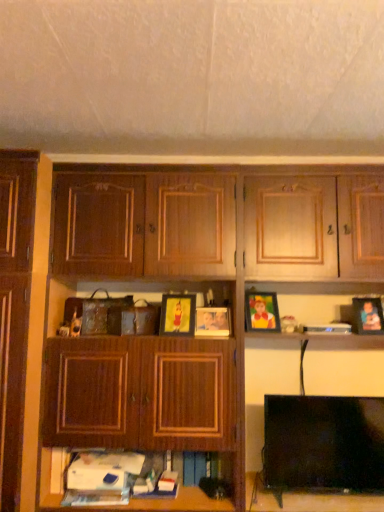
You are a GUI agent. You are given a task and a screenshot of the screen. Output one action in this format:
    pyautogui.click(x=<x>, y=<y>)
    Task: Click on the matte plastic picture frame at center, marked as the third picture frame in a left-to-right arrangement
    This screenshot has height=512, width=384.
    Given the screenshot: What is the action you would take?
    pyautogui.click(x=261, y=312)

What do you see at coordinates (367, 316) in the screenshot? The width and height of the screenshot is (384, 512). I see `matte plastic picture frame at right, which is counted as the fourth picture frame, starting from the left` at bounding box center [367, 316].

What do you see at coordinates (169, 288) in the screenshot?
I see `wooden cabinet at center` at bounding box center [169, 288].

Identify the location of matte wooden picture frame at center, acting as the third picture frame starting from the right. Image resolution: width=384 pixels, height=512 pixels. (213, 322).

From the image's perspective, between matte plastic picture frame at center, marked as the third picture frame in a left-to-right arrangement, and matte wooden picture frame at center, which is the first picture frame from left to right, who is located below?

From the image's view, matte wooden picture frame at center, which is the first picture frame from left to right, is below.

Which is behind, point (278, 328) or point (185, 300)?

The point (185, 300) is more distant.

Considering the relative sizes of matte plastic picture frame at center, marked as the third picture frame in a left-to-right arrangement, and matte wooden picture frame at center, which is the first picture frame from left to right, in the image provided, is matte plastic picture frame at center, marked as the third picture frame in a left-to-right arrangement, thinner than matte wooden picture frame at center, which is the first picture frame from left to right,?

No, matte plastic picture frame at center, marked as the third picture frame in a left-to-right arrangement, is not thinner than matte wooden picture frame at center, which is the first picture frame from left to right.

Which object is positioned more to the left, matte plastic picture frame at center, marked as the third picture frame in a left-to-right arrangement, or matte wooden picture frame at center, which ranks as the 4th picture frame in right-to-left order?

matte wooden picture frame at center, which ranks as the 4th picture frame in right-to-left order, is more to the left.

Is point (330, 329) closer or farther from the camera than point (176, 328)?

Point (330, 329) is positioned farther from the camera compared to point (176, 328).

Is black plastic book at upper right facing towards matte wooden picture frame at center, which is the first picture frame from left to right?

No, black plastic book at upper right is not facing towards matte wooden picture frame at center, which is the first picture frame from left to right.

Is black plastic book at upper right positioned behind matte wooden picture frame at center, which is the first picture frame from left to right?

That is True.

From the image's perspective, which picture frame is the 3rd one above the black plastic book at upper right? Please provide its 2D coordinates.

[(177, 315)]

Looking at the image, does wooden cabinet at center seem bigger or smaller compared to matte plastic picture frame at right, the first picture frame positioned from the right?

In the image, wooden cabinet at center appears to be larger than matte plastic picture frame at right, the first picture frame positioned from the right.

Can you tell me how much wooden cabinet at center and matte plastic picture frame at right, which is counted as the fourth picture frame, starting from the left, differ in facing direction?

The angular difference between wooden cabinet at center and matte plastic picture frame at right, which is counted as the fourth picture frame, starting from the left, is 2.25 degrees.

Does wooden cabinet at center have a greater width compared to matte plastic picture frame at right, the first picture frame positioned from the right?

Indeed, wooden cabinet at center has a greater width compared to matte plastic picture frame at right, the first picture frame positioned from the right.

Is wooden cabinet at center positioned with its back to matte wooden picture frame at center, which ranks as the 4th picture frame in right-to-left order?

Yes, wooden cabinet at center's orientation is away from matte wooden picture frame at center, which ranks as the 4th picture frame in right-to-left order.

Does wooden cabinet at center come in front of matte wooden picture frame at center, which ranks as the 4th picture frame in right-to-left order?

Yes.

Is point (156, 387) less distant than point (168, 294)?

Yes, point (156, 387) is closer to viewer.

Is black plastic book at upper right aimed at black glossy tv at lower right?

No.

Which of these two, black plastic book at upper right or black glossy tv at lower right, is bigger?

black glossy tv at lower right.

From a real-world perspective, is black plastic book at upper right located beneath black glossy tv at lower right?

No, from a real-world perspective, black plastic book at upper right is not below black glossy tv at lower right.

Is black plastic book at upper right oriented towards matte plastic picture frame at center, which is counted as the 2th picture frame, starting from the right?

No, black plastic book at upper right is not facing towards matte plastic picture frame at center, which is counted as the 2th picture frame, starting from the right.

Does black plastic book at upper right lie in front of matte plastic picture frame at center, marked as the third picture frame in a left-to-right arrangement?

That is True.

Is black plastic book at upper right taller than matte plastic picture frame at center, marked as the third picture frame in a left-to-right arrangement?

No.

From the image's perspective, which object appears higher, black plastic book at upper right or matte plastic picture frame at center, marked as the third picture frame in a left-to-right arrangement?

matte plastic picture frame at center, marked as the third picture frame in a left-to-right arrangement, from the image's perspective.

Considering the relative sizes of matte wooden picture frame at center, acting as the third picture frame starting from the right, and matte plastic picture frame at right, the first picture frame positioned from the right, in the image provided, is matte wooden picture frame at center, acting as the third picture frame starting from the right, wider than matte plastic picture frame at right, the first picture frame positioned from the right,?

Incorrect, the width of matte wooden picture frame at center, acting as the third picture frame starting from the right, does not surpass that of matte plastic picture frame at right, the first picture frame positioned from the right.

Is matte wooden picture frame at center, acting as the third picture frame starting from the right, oriented away from matte plastic picture frame at right, the first picture frame positioned from the right?

No, matte wooden picture frame at center, acting as the third picture frame starting from the right,'s orientation is not away from matte plastic picture frame at right, the first picture frame positioned from the right.

Does matte wooden picture frame at center, which is the 2th picture frame in left-to-right order, have a greater height compared to matte plastic picture frame at right, the first picture frame positioned from the right?

No, matte wooden picture frame at center, which is the 2th picture frame in left-to-right order, is not taller than matte plastic picture frame at right, the first picture frame positioned from the right.

From a real-world perspective, does matte wooden picture frame at center, which is the 2th picture frame in left-to-right order, sit lower than matte plastic picture frame at right, which is counted as the fourth picture frame, starting from the left?

Yes, from a real-world perspective, matte wooden picture frame at center, which is the 2th picture frame in left-to-right order, is below matte plastic picture frame at right, which is counted as the fourth picture frame, starting from the left.

You are a GUI agent. You are given a task and a screenshot of the screen. Output one action in this format:
    pyautogui.click(x=<x>, y=<y>)
    Task: Click on the picture frame that appears above the matte wooden picture frame at center, which is the first picture frame from left to right (from the image's perspective)
    The image size is (384, 512).
    Given the screenshot: What is the action you would take?
    pyautogui.click(x=261, y=312)

Identify the location of book that is behind the matte wooden picture frame at center, which is the first picture frame from left to right. (326, 328).

Estimate the real-world distances between objects in this image. Which object is closer to matte wooden picture frame at center, acting as the third picture frame starting from the right, wooden cabinet at center or black glossy tv at lower right?

Among the two, wooden cabinet at center is located nearer to matte wooden picture frame at center, acting as the third picture frame starting from the right.

From the image, which object appears to be farther from matte plastic picture frame at center, marked as the third picture frame in a left-to-right arrangement, matte wooden picture frame at center, acting as the third picture frame starting from the right, or matte plastic picture frame at right, which is counted as the fourth picture frame, starting from the left?

matte plastic picture frame at right, which is counted as the fourth picture frame, starting from the left, is further to matte plastic picture frame at center, marked as the third picture frame in a left-to-right arrangement.

Based on their spatial positions, is black plastic book at upper right or matte wooden picture frame at center, which ranks as the 4th picture frame in right-to-left order, further from wooden cabinet at center?

black plastic book at upper right is positioned further to the anchor wooden cabinet at center.

When comparing their distances from matte plastic picture frame at right, the first picture frame positioned from the right, does black plastic book at upper right or matte wooden picture frame at center, which is the first picture frame from left to right, seem further?

matte wooden picture frame at center, which is the first picture frame from left to right, is further to matte plastic picture frame at right, the first picture frame positioned from the right.

Based on their spatial positions, is black glossy tv at lower right or matte plastic picture frame at right, which is counted as the fourth picture frame, starting from the left, closer to wooden cabinet at center?

black glossy tv at lower right is closer to wooden cabinet at center.

Based on their spatial positions, is matte wooden picture frame at center, which is the 2th picture frame in left-to-right order, or wooden cabinet at center closer to black plastic book at upper right?

Based on the image, matte wooden picture frame at center, which is the 2th picture frame in left-to-right order, appears to be nearer to black plastic book at upper right.

Considering their positions, is wooden cabinet at center positioned closer to black glossy tv at lower right than matte wooden picture frame at center, acting as the third picture frame starting from the right?

wooden cabinet at center is positioned closer to the anchor black glossy tv at lower right.

Looking at the image, which one is located closer to black glossy tv at lower right, matte plastic picture frame at center, which is counted as the 2th picture frame, starting from the right, or matte wooden picture frame at center, which is the first picture frame from left to right?

matte plastic picture frame at center, which is counted as the 2th picture frame, starting from the right, is positioned closer to the anchor black glossy tv at lower right.

Find the location of a particular element. The width and height of the screenshot is (384, 512). cupboard between matte wooden picture frame at center, which is the first picture frame from left to right, and black plastic book at upper right, in the horizontal direction is located at coordinates (169, 288).

The height and width of the screenshot is (512, 384). Find the location of `cupboard between matte wooden picture frame at center, which ranks as the 4th picture frame in right-to-left order, and matte plastic picture frame at right, the first picture frame positioned from the right`. cupboard between matte wooden picture frame at center, which ranks as the 4th picture frame in right-to-left order, and matte plastic picture frame at right, the first picture frame positioned from the right is located at coordinates (169, 288).

Locate an element on the screen. Image resolution: width=384 pixels, height=512 pixels. television between matte wooden picture frame at center, acting as the third picture frame starting from the right, and black plastic book at upper right, in the horizontal direction is located at coordinates (323, 443).

Where is `cupboard between matte wooden picture frame at center, which is the first picture frame from left to right, and matte plastic picture frame at center, which is counted as the 2th picture frame, starting from the right`? Image resolution: width=384 pixels, height=512 pixels. cupboard between matte wooden picture frame at center, which is the first picture frame from left to right, and matte plastic picture frame at center, which is counted as the 2th picture frame, starting from the right is located at coordinates (169, 288).